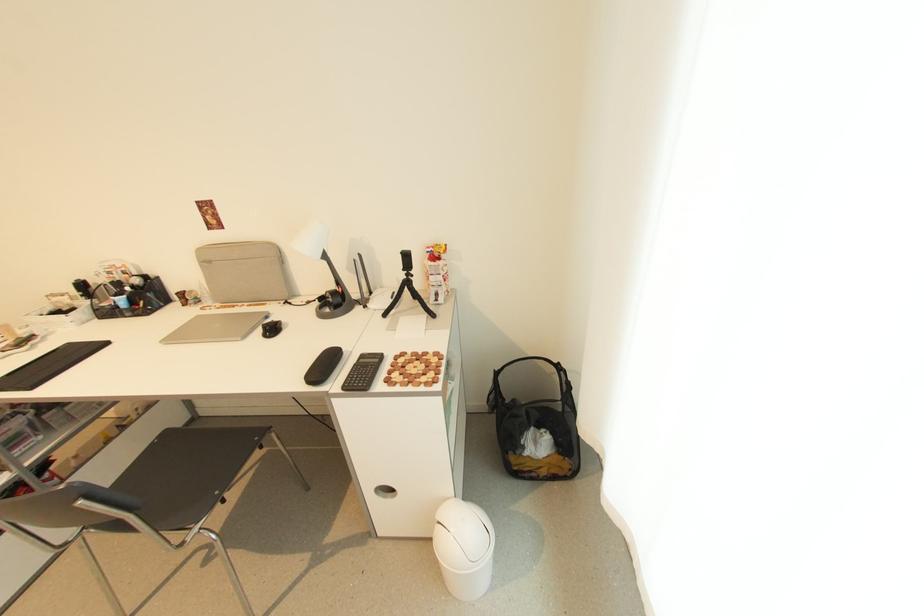
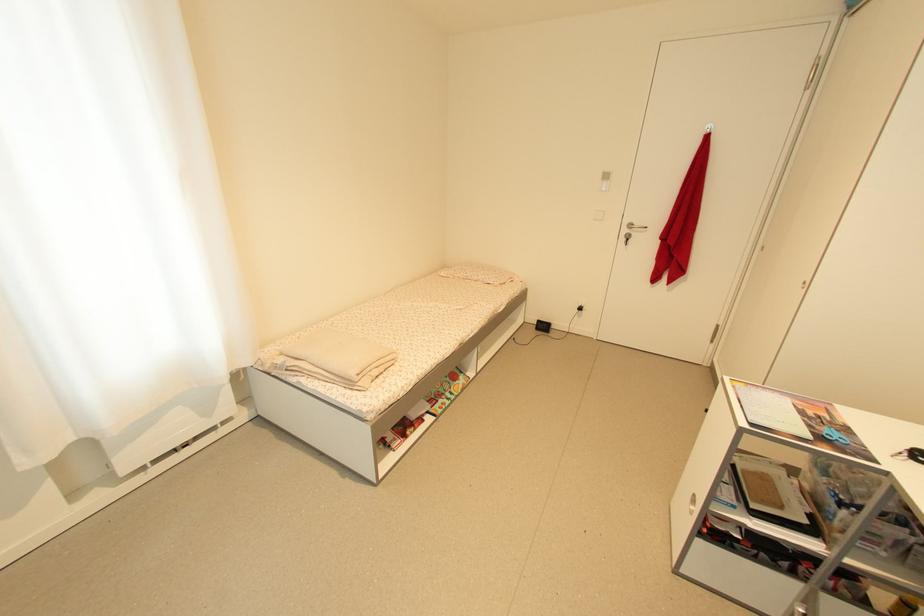
The first image is from the beginning of the video and the second image is from the end. How did the camera likely rotate when shooting the video?

The camera rotated toward left-down.